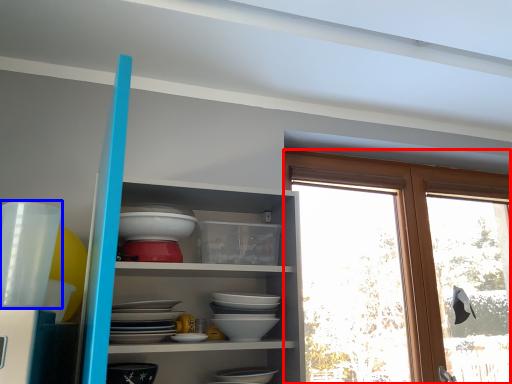
Question: Which point is further to the camera, window (highlighted by a red box) or tableware (highlighted by a blue box)?

Choices:
 (A) window
 (B) tableware

Answer: (A)